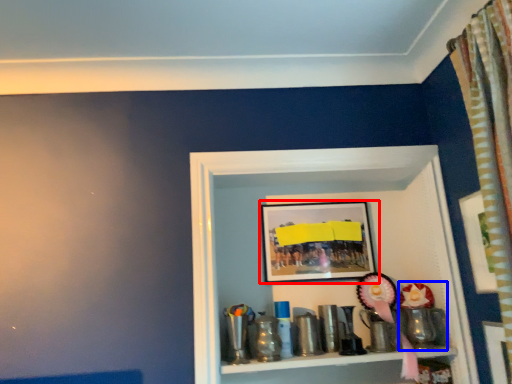
Question: Which point is further to the camera, picture frame (highlighted by a red box) or toy (highlighted by a blue box)?

Choices:
 (A) picture frame
 (B) toy

Answer: (A)